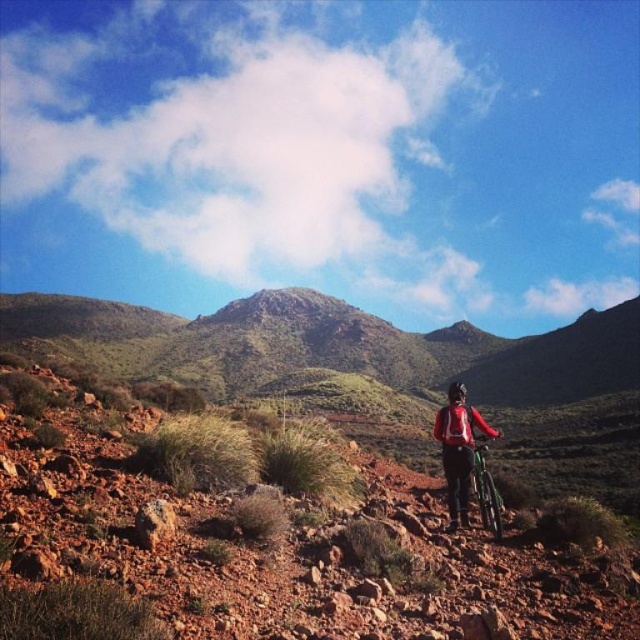
You are a hiker planning to join the cyclist on the same path. You see the red matte jacket at center and the green metallic mountain bike at center in the image. Which object is positioned higher relative to the other?

The red matte jacket at center is located above the green metallic mountain bike at center, so the red matte jacket at center is higher.

You are a hiker trying to locate a specific point marked on a map in this desert biking area. The point is at coordinates point (458, 449). According to the image, where would you find this point?

The point (458, 449) is located on the red matte jacket at center, which belongs to the cyclist in the foreground on the right side of the frame.

You are a delivery drone that needs to fly between the red matte jacket at center and the green metallic mountain bike at center. What is the minimum distance you need to cover?

The minimum distance you need to cover between the red matte jacket at center and the green metallic mountain bike at center is 28.88 inches.